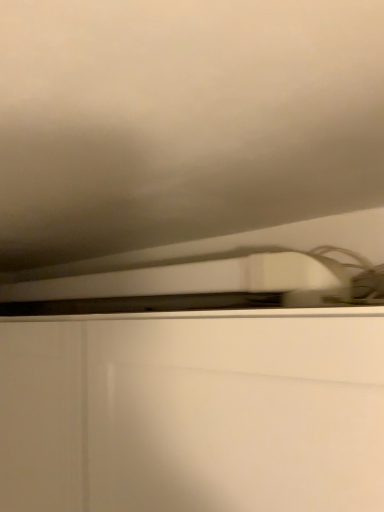
Measure the distance between white matte cloud at upper center and camera.

They are 8.90 inches apart.

Locate an element on the screen. The image size is (384, 512). white matte cloud at upper center is located at coordinates (182, 121).

Image resolution: width=384 pixels, height=512 pixels. What do you see at coordinates (182, 121) in the screenshot?
I see `white matte cloud at upper center` at bounding box center [182, 121].

Measure the distance between point (197,3) and camera.

They are 22.30 centimeters apart.

At what (x,y) coordinates should I click in order to perform the action: click on white matte cloud at upper center. Please return your answer as a coordinate pair (x, y). This screenshot has height=512, width=384. Looking at the image, I should click on (182, 121).